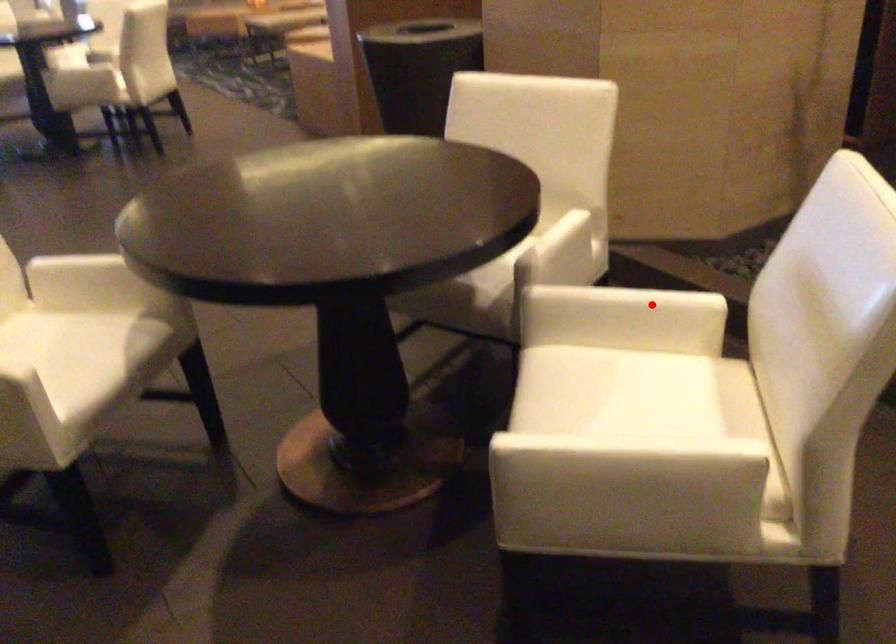
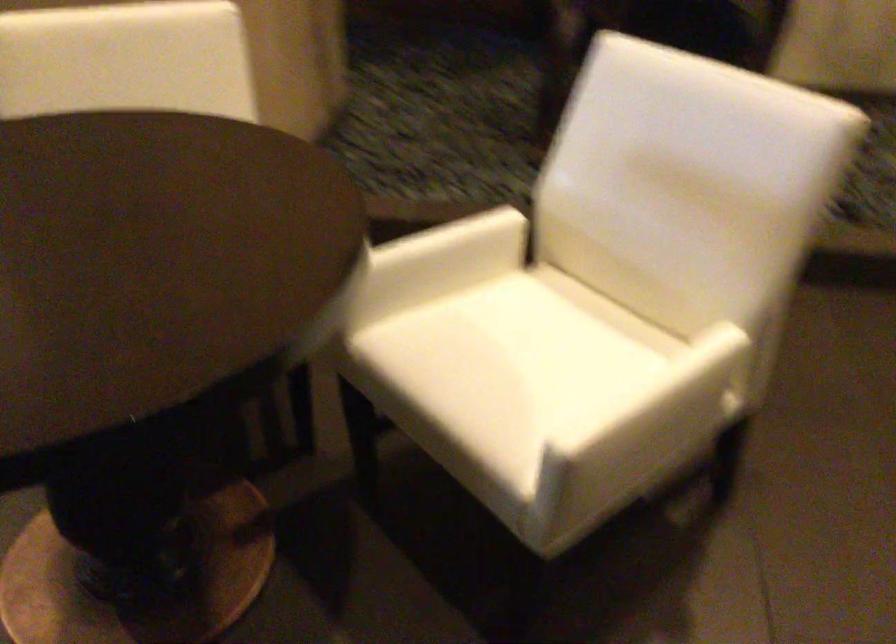
Question: I am providing you with two images of the same scene from different viewpoints. Given a red point in image1, look at the same physical point in image2. Is it:

Choices:
 (A) Closer to the viewpoint
 (B) Farther from the viewpoint

Answer: (A)